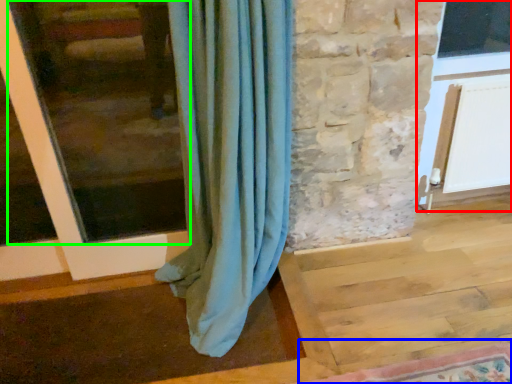
Question: Estimate the real-world distances between objects in this image. Which object is farther from screen door (highlighted by a red box), mat (highlighted by a blue box) or window frame (highlighted by a green box)?

Choices:
 (A) mat
 (B) window frame

Answer: (B)